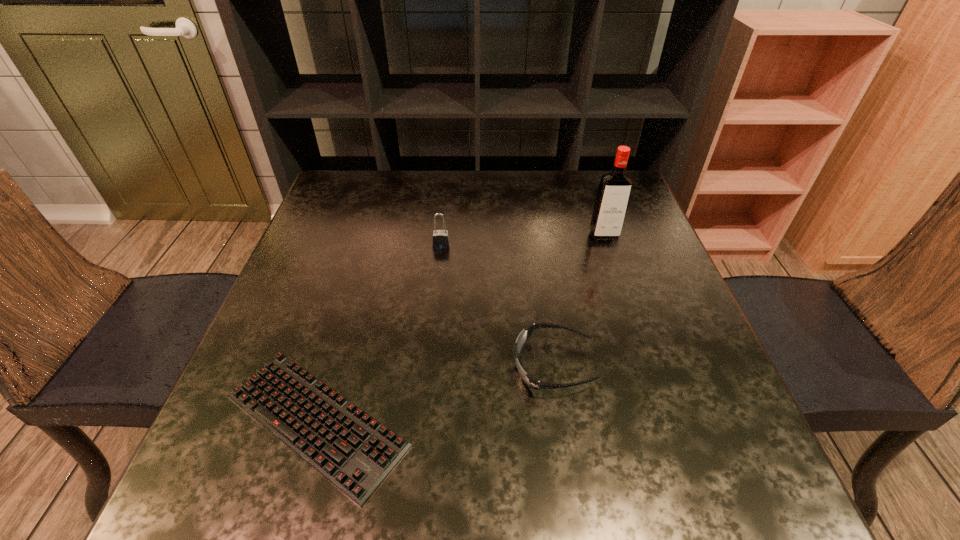
Where is `vodka`? The width and height of the screenshot is (960, 540). vodka is located at coordinates [x=615, y=186].

Identify the location of the rightmost object. This screenshot has width=960, height=540. (615, 186).

At what (x,y) coordinates should I click in order to perform the action: click on the second farthest object. Please return your answer as a coordinate pair (x, y). The height and width of the screenshot is (540, 960). Looking at the image, I should click on (440, 239).

What are the coordinates of `padlock` in the screenshot? It's located at (440, 239).

Find the location of a particular element. the third object from left to right is located at coordinates (522, 339).

Find the location of a particular element. the third tallest object is located at coordinates (522, 339).

Locate an element on the screen. The width and height of the screenshot is (960, 540). the shortest object is located at coordinates (351, 449).

The height and width of the screenshot is (540, 960). Identify the location of free location located on the front and back of the tallest object. (652, 377).

Where is `free space located 0.160m on the shackle of the second tallest object`? The image size is (960, 540). free space located 0.160m on the shackle of the second tallest object is located at coordinates (436, 296).

The image size is (960, 540). What are the coordinates of `free space located on the lenses of the sunglasses` in the screenshot? It's located at (311, 365).